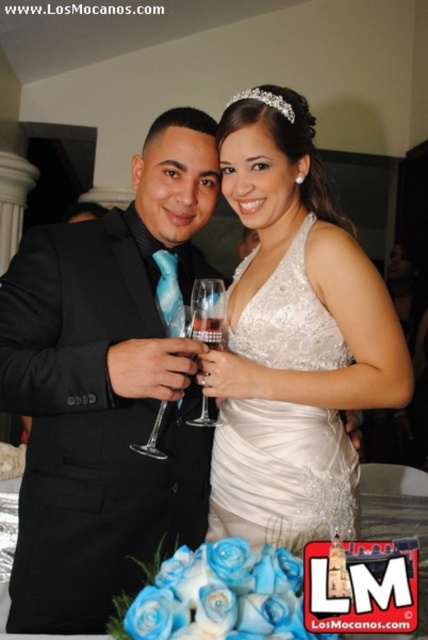
Does clear crystal wine glass at center appear on the left side of clear glass wine glass at center?

Incorrect, clear crystal wine glass at center is not on the left side of clear glass wine glass at center.

Can you confirm if clear crystal wine glass at center is bigger than clear glass wine glass at center?

Actually, clear crystal wine glass at center might be smaller than clear glass wine glass at center.

Describe the element at coordinates (208, 310) in the screenshot. I see `clear crystal wine glass at center` at that location.

Where is `clear crystal wine glass at center`? clear crystal wine glass at center is located at coordinates (208, 310).

How distant is black satin suit at left from clear crystal wine glass at center?

black satin suit at left and clear crystal wine glass at center are 8.79 inches apart.

Between black satin suit at left and clear crystal wine glass at center, which one appears on the right side from the viewer's perspective?

Positioned to the right is clear crystal wine glass at center.

Does point (32, 595) lie in front of point (204, 317)?

Yes, it is.

You are a GUI agent. You are given a task and a screenshot of the screen. Output one action in this format:
    pyautogui.click(x=<x>, y=<y>)
    Task: Click on the black satin suit at left
    The image size is (428, 640).
    Given the screenshot: What is the action you would take?
    pyautogui.click(x=107, y=385)

Is white satin dress at center below clear glass wine glass at center?

Actually, white satin dress at center is above clear glass wine glass at center.

Which is more to the left, white satin dress at center or clear glass wine glass at center?

clear glass wine glass at center is more to the left.

Describe the element at coordinates (281, 474) in the screenshot. Image resolution: width=428 pixels, height=640 pixels. I see `white satin dress at center` at that location.

I want to click on white satin dress at center, so click(x=281, y=474).